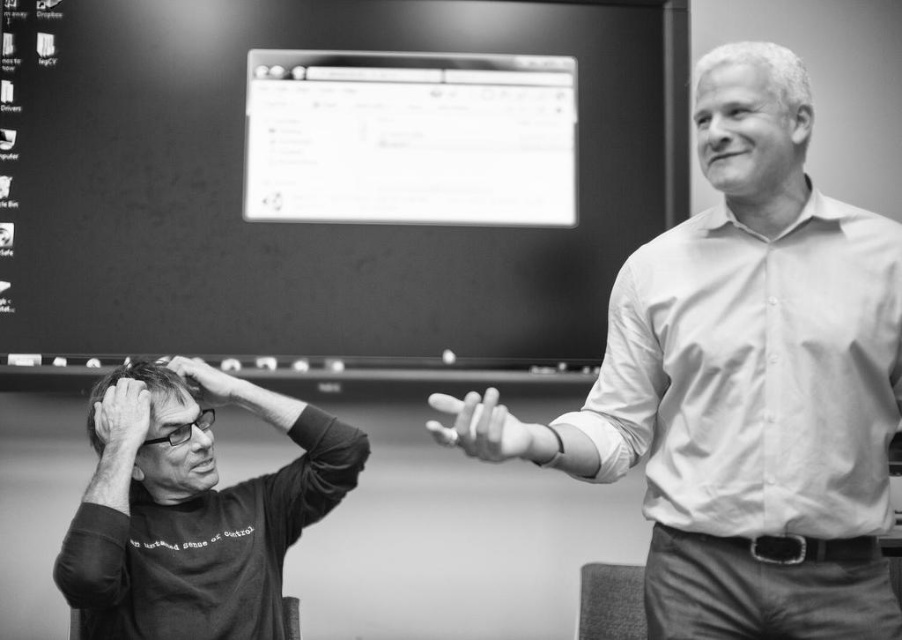
Question: Which is nearer to the smooth skin hand at upper center?

Choices:
 (A) matte black hand at lower left
 (B) dark gray shirt at left

Answer: (A)

Question: Which point is farther to the camera?

Choices:
 (A) (200, 378)
 (B) (762, 84)

Answer: (A)

Question: Can you confirm if smooth skin hand at center is positioned to the right of smooth skin hand at upper center?

Choices:
 (A) yes
 (B) no

Answer: (A)

Question: Which point is farther to the camera?

Choices:
 (A) (183, 365)
 (B) (758, 84)

Answer: (A)

Question: Considering the relative positions of smooth skin head at left and smooth skin forehead at upper center in the image provided, where is smooth skin head at left located with respect to smooth skin forehead at upper center?

Choices:
 (A) above
 (B) below

Answer: (B)

Question: Can you confirm if smooth cotton shirt at right is thinner than smooth skin hand at upper center?

Choices:
 (A) yes
 (B) no

Answer: (B)